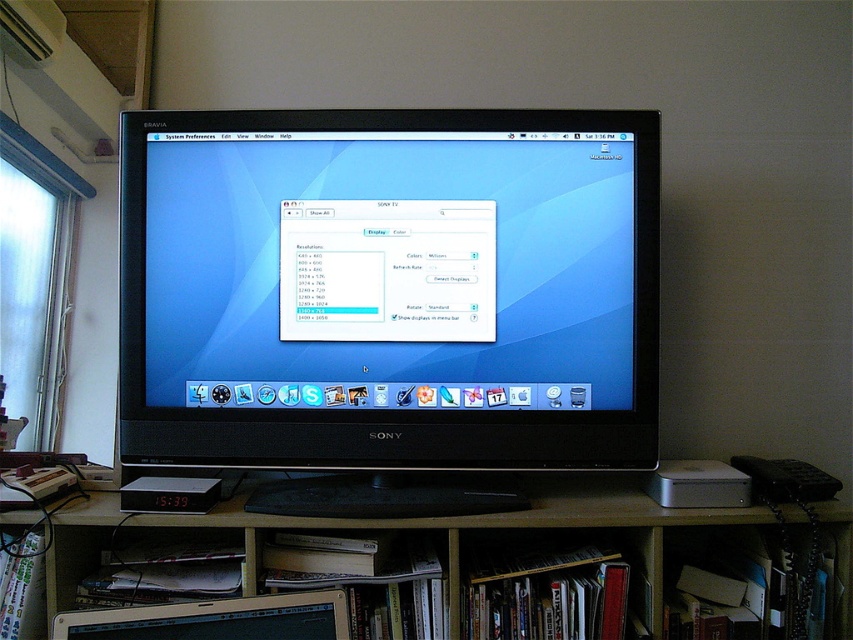
Is black glossy monitor at center closer to the viewer compared to wooden at lower center?

No, black glossy monitor at center is further to the viewer.

Can you confirm if black glossy monitor at center is bigger than wooden at lower center?

Actually, black glossy monitor at center might be smaller than wooden at lower center.

Which is in front, point (370, 256) or point (386, 632)?

Point (386, 632)

Where is `black glossy monitor at center`? black glossy monitor at center is located at coordinates (389, 289).

Who is lower down, wooden at lower center or metallic silver laptop at lower center?

metallic silver laptop at lower center is lower down.

Image resolution: width=853 pixels, height=640 pixels. Describe the element at coordinates (463, 566) in the screenshot. I see `wooden at lower center` at that location.

This screenshot has width=853, height=640. I want to click on wooden at lower center, so click(x=463, y=566).

Is wooden at lower center smaller than dark wood bookshelf at lower center?

No, wooden at lower center is not smaller than dark wood bookshelf at lower center.

Can you confirm if wooden at lower center is positioned to the left of dark wood bookshelf at lower center?

Indeed, wooden at lower center is positioned on the left side of dark wood bookshelf at lower center.

Does point (431, 577) lie in front of point (538, 602)?

That is True.

Locate an element on the screen. wooden at lower center is located at coordinates (x=463, y=566).